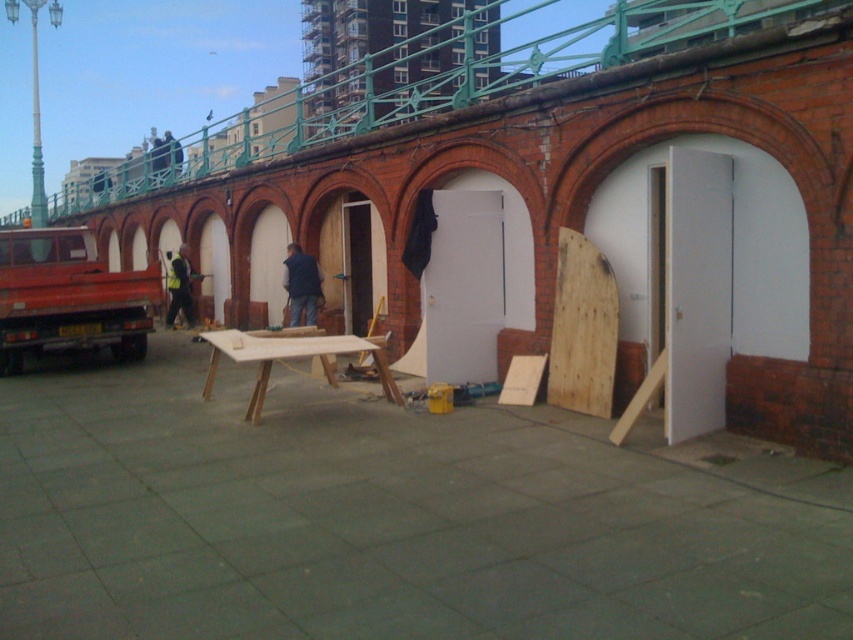
Is dark blue jacket at center behind reflective yellow safety vest at center?

No, dark blue jacket at center is closer to the viewer.

Which is more to the left, dark blue jacket at center or reflective yellow safety vest at center?

reflective yellow safety vest at center

The height and width of the screenshot is (640, 853). What are the coordinates of `dark blue jacket at center` in the screenshot? It's located at (300, 284).

Which of these two, wooden at center or dark blue jacket at center, stands shorter?

Standing shorter between the two is dark blue jacket at center.

Does wooden at center have a smaller size compared to dark blue jacket at center?

Actually, wooden at center might be larger than dark blue jacket at center.

Which is behind, point (555, 353) or point (306, 275)?

Positioned behind is point (306, 275).

This screenshot has height=640, width=853. Find the location of `wooden at center`. wooden at center is located at coordinates (582, 328).

Is white matte door at center to the left of wooden at center from the viewer's perspective?

Correct, you'll find white matte door at center to the left of wooden at center.

Locate an element on the screen. Image resolution: width=853 pixels, height=640 pixels. white matte door at center is located at coordinates (473, 278).

Who is more distant from viewer, (457, 372) or (614, 320)?

Positioned behind is point (457, 372).

Identify the location of white matte door at center. The height and width of the screenshot is (640, 853). (473, 278).